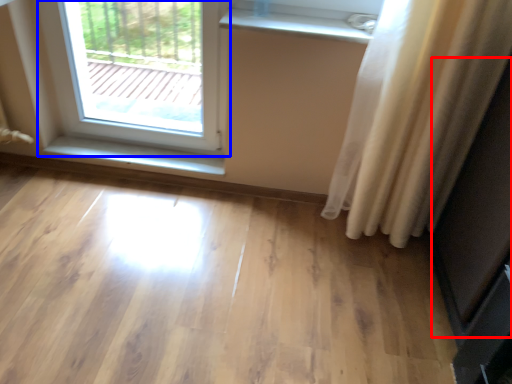
Question: Which point is further to the camera, screen door (highlighted by a red box) or window (highlighted by a blue box)?

Choices:
 (A) screen door
 (B) window

Answer: (B)